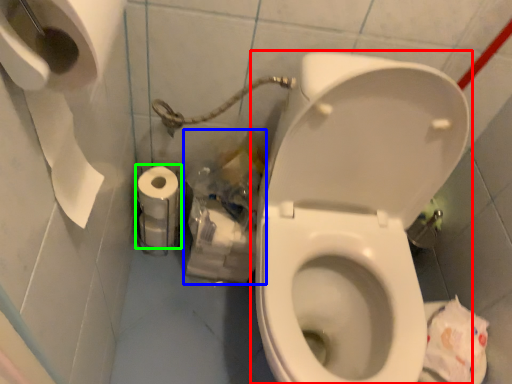
Question: Considering the real-world distances, which object is farthest from toilet (highlighted by a red box)? garbage (highlighted by a blue box) or toilet paper (highlighted by a green box)?

Choices:
 (A) garbage
 (B) toilet paper

Answer: (B)